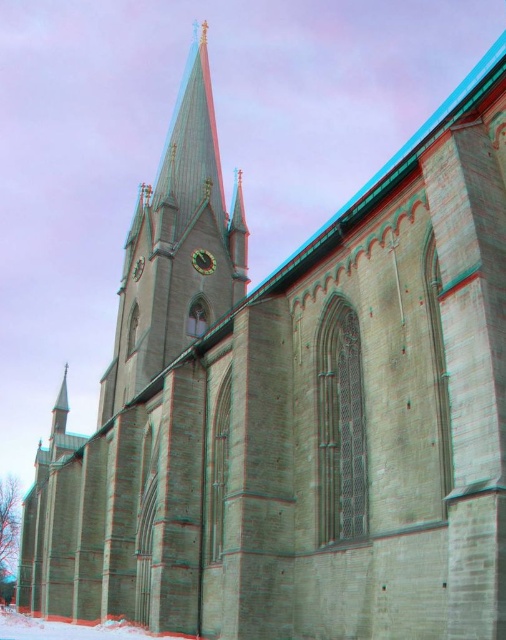
Question: Does green stone steeple at upper center have a larger size compared to metallic clock at center?

Choices:
 (A) yes
 (B) no

Answer: (A)

Question: Is green stone steeple at upper center below metallic clock at center?

Choices:
 (A) yes
 (B) no

Answer: (B)

Question: Is green stone steeple at upper center thinner than metallic clock at center?

Choices:
 (A) no
 (B) yes

Answer: (A)

Question: Which point is closer to the camera taking this photo?

Choices:
 (A) (186, 224)
 (B) (194, 266)

Answer: (B)